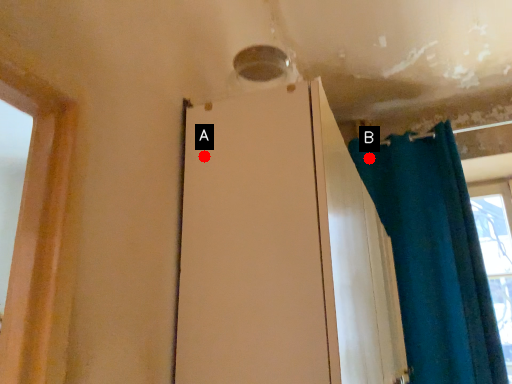
Question: Two points are circled on the image, labeled by A and B beside each circle. Which point is closer to the camera?

Choices:
 (A) A is closer
 (B) B is closer

Answer: (A)